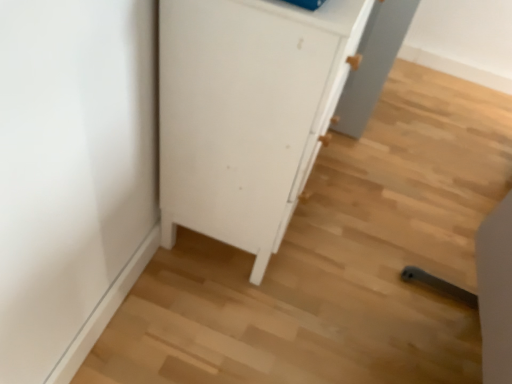
Locate an element on the screen. The height and width of the screenshot is (384, 512). space that is in front of white matte cabinet at center is located at coordinates (247, 317).